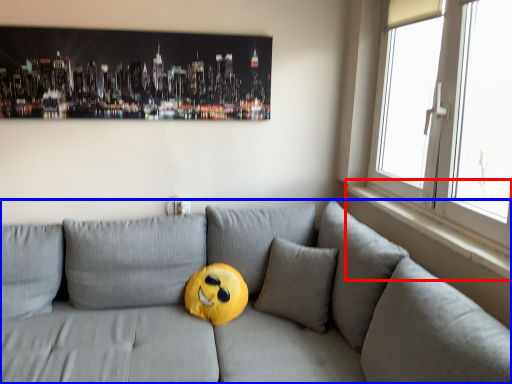
Question: Which point is closer to the camera, window sill (highlighted by a red box) or studio couch (highlighted by a blue box)?

Choices:
 (A) window sill
 (B) studio couch

Answer: (B)